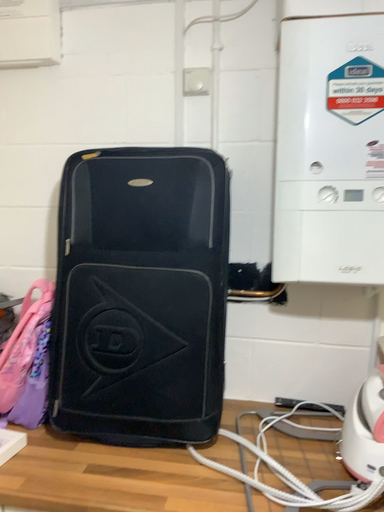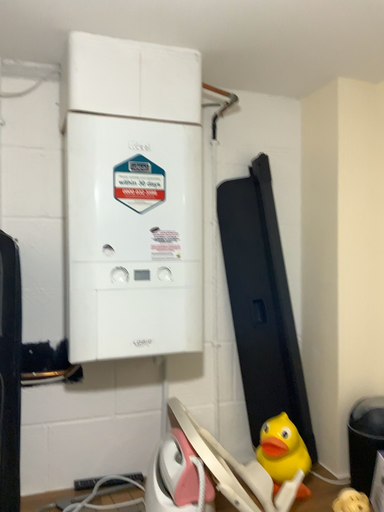
Question: Which way did the camera rotate in the video?

Choices:
 (A) rotated right
 (B) rotated left

Answer: (A)